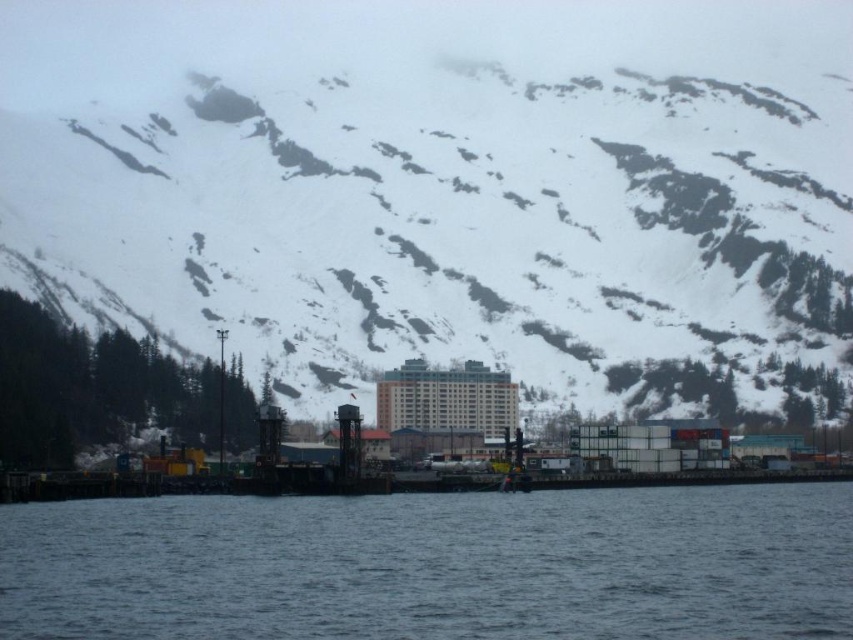
Based on the provided image, what are the coordinates of the snowy rock at upper center in the scene?

The coordinates of the snowy rock at upper center are at point (448, 221).